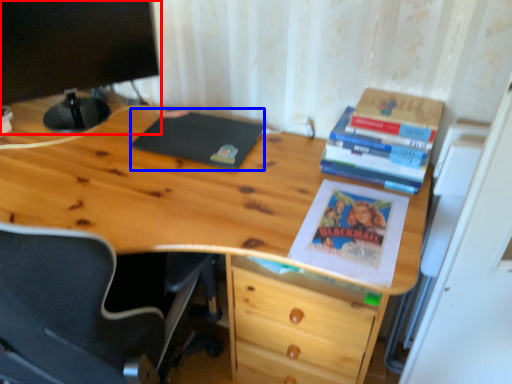
Question: Which of the following is the farthest to the observer, computer monitor (highlighted by a red box) or notebook (highlighted by a blue box)?

Choices:
 (A) computer monitor
 (B) notebook

Answer: (B)